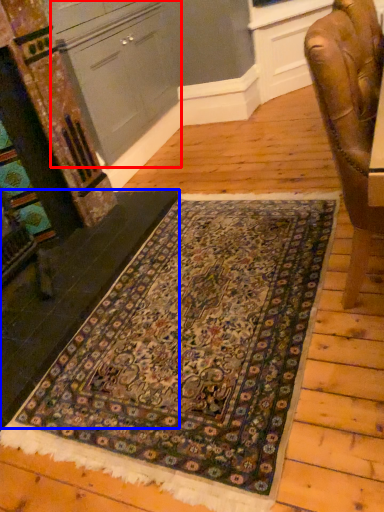
Question: Which object is closer to the camera taking this photo, cabinetry (highlighted by a red box) or stair (highlighted by a blue box)?

Choices:
 (A) cabinetry
 (B) stair

Answer: (B)